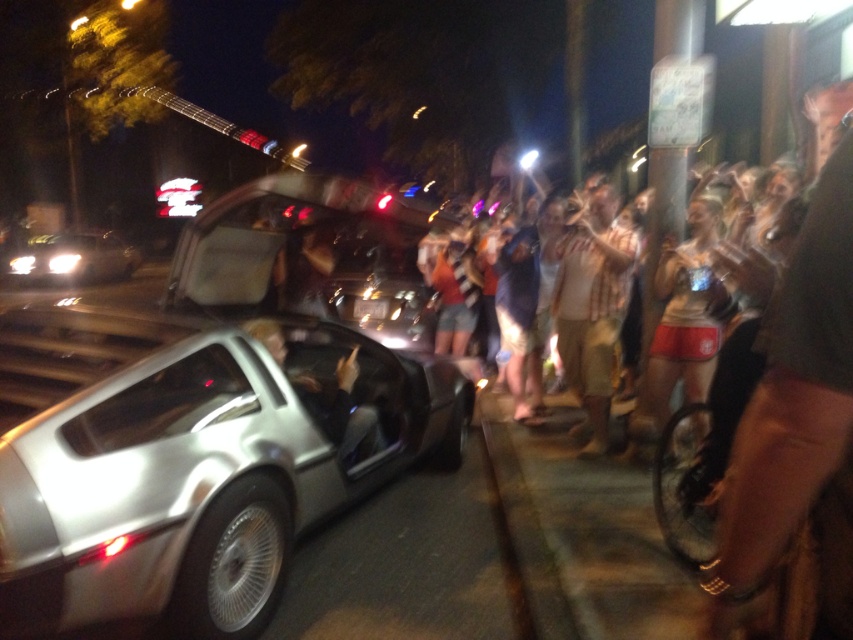
You are a photographer at the event and want to capture both the white cotton shirt at center and the matte white tank tops at center in a single photo. Which clothing item should you position slightly to the left to ensure both are visible in the frame?

The white cotton shirt at center is to the right of matte white tank tops at center, so you should position the white cotton shirt at center slightly to the left to ensure both are visible in the frame.

You are a photographer at the event and need to capture a photo of both the white cotton shirt at center and the matte white tank tops at center. Which clothing item should you focus on first if you want to ensure both are in frame without zooming in or out?

The white cotton shirt at center is smaller than the matte white tank tops at center, so you should focus on the matte white tank tops at center first to ensure both fit in the frame without zooming.

You are a photographer standing at the edge of the crowd. You want to take a photo of both the silver metallic delorean at center and the white cotton shirt at center in the same frame. Given that your camera has a maximum focus range of 6 feet, will you be able to capture both objects clearly in one shot?

The silver metallic delorean at center and white cotton shirt at center are 6.94 feet apart from each other. Since the distance between them exceeds the camera maximum focus range of 6 feet, you won